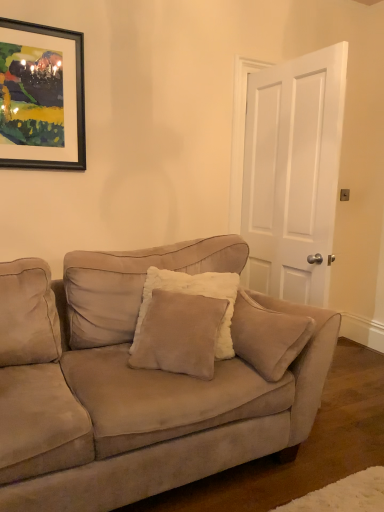
Question: Can you confirm if black matte picture frame at upper left is positioned to the left of white matte door at center?

Choices:
 (A) yes
 (B) no

Answer: (A)

Question: Is black matte picture frame at upper left looking in the opposite direction of white matte door at center?

Choices:
 (A) no
 (B) yes

Answer: (A)

Question: Is black matte picture frame at upper left further to camera compared to white matte door at center?

Choices:
 (A) yes
 (B) no

Answer: (B)

Question: Does black matte picture frame at upper left have a greater width compared to white matte door at center?

Choices:
 (A) yes
 (B) no

Answer: (B)

Question: Considering the relative sizes of black matte picture frame at upper left and white matte door at center in the image provided, is black matte picture frame at upper left smaller than white matte door at center?

Choices:
 (A) yes
 (B) no

Answer: (A)

Question: From their relative heights in the image, would you say suede couch at center is taller or shorter than white matte door at center?

Choices:
 (A) tall
 (B) short

Answer: (B)

Question: Is suede couch at center spatially inside white matte door at center, or outside of it?

Choices:
 (A) outside
 (B) inside

Answer: (A)

Question: In the image, is suede couch at center on the left side or the right side of white matte door at center?

Choices:
 (A) right
 (B) left

Answer: (B)

Question: From a real-world perspective, is suede couch at center above or below white matte door at center?

Choices:
 (A) below
 (B) above

Answer: (A)

Question: In the image, is white matte door at center on the left side or the right side of suede couch at center?

Choices:
 (A) right
 (B) left

Answer: (A)

Question: From the image's perspective, is white matte door at center positioned above or below suede couch at center?

Choices:
 (A) below
 (B) above

Answer: (B)

Question: Choose the correct answer: Is white matte door at center inside suede couch at center or outside it?

Choices:
 (A) outside
 (B) inside

Answer: (A)

Question: Does point (294, 287) appear closer or farther from the camera than point (36, 286)?

Choices:
 (A) closer
 (B) farther

Answer: (B)

Question: Considering the positions of point (294, 211) and point (56, 122), is point (294, 211) closer or farther from the camera than point (56, 122)?

Choices:
 (A) farther
 (B) closer

Answer: (A)

Question: In terms of size, does white matte door at center appear bigger or smaller than black matte picture frame at upper left?

Choices:
 (A) big
 (B) small

Answer: (A)